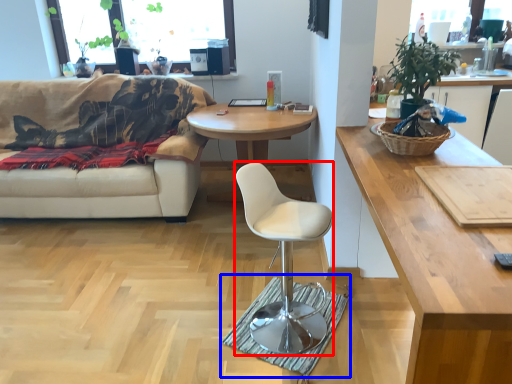
Question: Which of the following is the farthest to the observer, chair (highlighted by a red box) or mat (highlighted by a blue box)?

Choices:
 (A) chair
 (B) mat

Answer: (B)